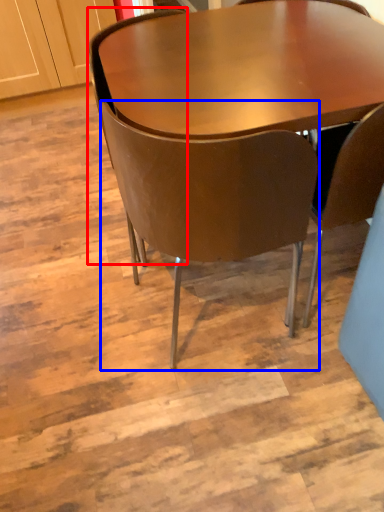
Question: Which of the following is the closest to the observer, chair (highlighted by a red box) or chair (highlighted by a blue box)?

Choices:
 (A) chair
 (B) chair

Answer: (B)